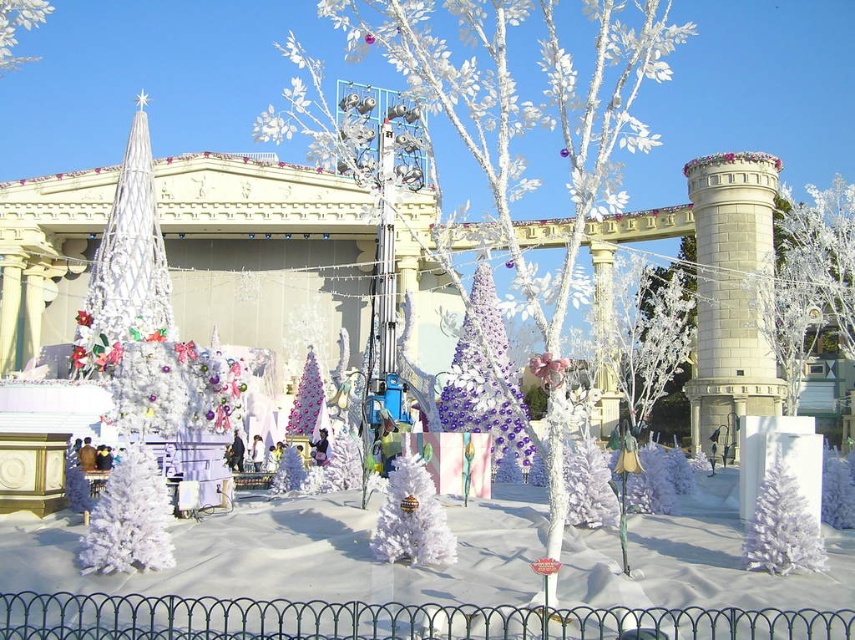
From the picture: Between shiny purple tinsel tree at center and pink glittery tree at center, which one appears on the left side from the viewer's perspective?

Positioned to the left is pink glittery tree at center.

Between shiny purple tinsel tree at center and pink glittery tree at center, which one has less height?

pink glittery tree at center is shorter.

In the scene shown: Who is more distant from viewer, (457, 369) or (292, 424)?

The point (292, 424) is more distant.

Image resolution: width=855 pixels, height=640 pixels. Find the location of `shiny purple tinsel tree at center`. shiny purple tinsel tree at center is located at coordinates pyautogui.click(x=485, y=378).

Is white matte tree at upper left wider than pink glittery tree at center?

Yes.

Which of these two, white matte tree at upper left or pink glittery tree at center, stands taller?

white matte tree at upper left is taller.

Is point (22, 12) farther from camera compared to point (310, 428)?

No, it is in front of (310, 428).

Find the location of a particular element. The height and width of the screenshot is (640, 855). white matte tree at upper left is located at coordinates (18, 26).

Is white matte tree at lower left positioned before pink glittery tree at center?

Yes.

Is white matte tree at lower left to the right of pink glittery tree at center from the viewer's perspective?

No, white matte tree at lower left is not to the right of pink glittery tree at center.

Does point (139, 525) lie behind point (315, 410)?

No, it is not.

At what (x,y) coordinates should I click in order to perform the action: click on white matte tree at lower left. Please return your answer as a coordinate pair (x, y). Looking at the image, I should click on (128, 518).